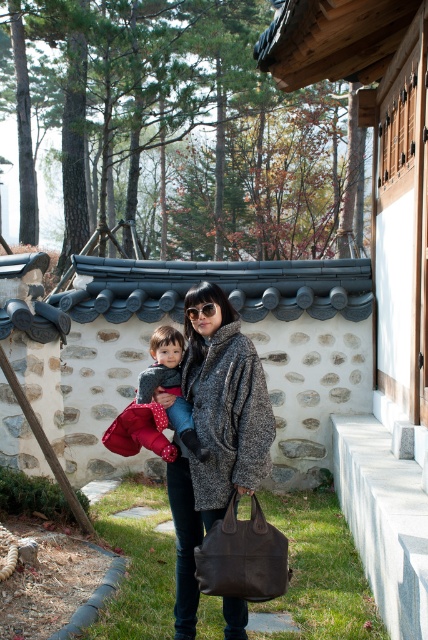
Question: Observing the image, what is the correct spatial positioning of textured gray coat at center in reference to brown leather bag at lower center?

Choices:
 (A) left
 (B) right

Answer: (A)

Question: Which point is closer to the camera?

Choices:
 (A) brown leather bag at lower center
 (B) polka dot fabric baby at center

Answer: (A)

Question: Does textured gray coat at center come in front of brown leather bag at lower center?

Choices:
 (A) no
 (B) yes

Answer: (A)

Question: Which point appears farthest from the camera in this image?

Choices:
 (A) (178, 435)
 (B) (222, 540)
 (C) (238, 465)

Answer: (A)

Question: Does textured gray coat at center come behind brown leather bag at lower center?

Choices:
 (A) no
 (B) yes

Answer: (B)

Question: Among these objects, which one is nearest to the camera?

Choices:
 (A) textured gray coat at center
 (B) polka dot fabric baby at center

Answer: (A)